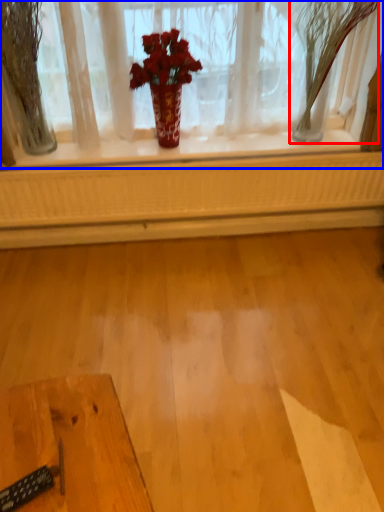
Question: Which of the following is the closest to the observer, tree (highlighted by a red box) or window (highlighted by a blue box)?

Choices:
 (A) tree
 (B) window

Answer: (A)